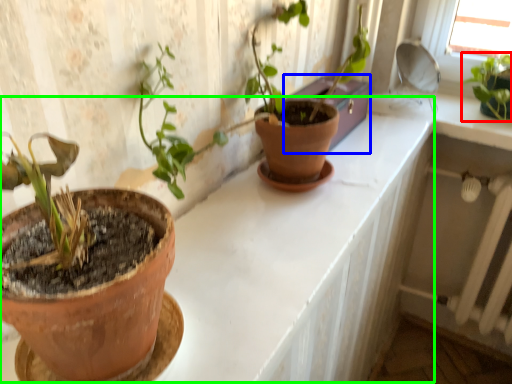
Question: Based on their relative distances, which object is nearer to houseplant (highlighted by a red box)? Choose from window box (highlighted by a blue box) and counter (highlighted by a green box).

Choices:
 (A) window box
 (B) counter

Answer: (A)